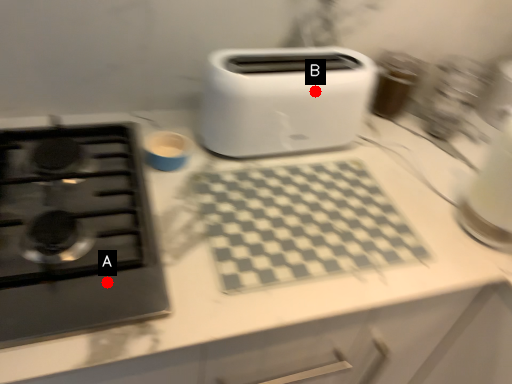
Question: Two points are circled on the image, labeled by A and B beside each circle. Which point is closer to the camera taking this photo?

Choices:
 (A) A is closer
 (B) B is closer

Answer: (A)